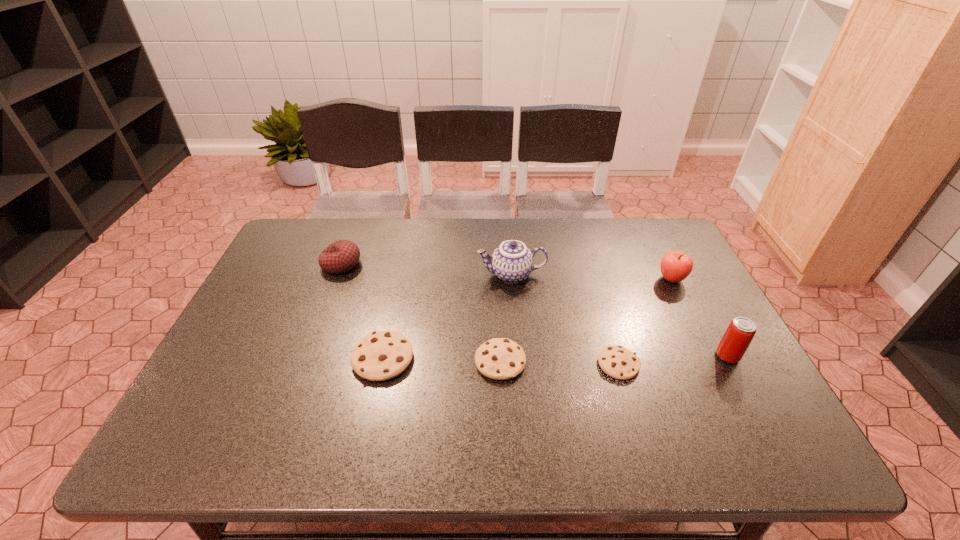
In the image, there is a desktop. Where is `vacant space at the far left corner`? This screenshot has height=540, width=960. vacant space at the far left corner is located at coordinates (331, 220).

This screenshot has height=540, width=960. I want to click on vacant region at the far right corner of the desktop, so click(660, 253).

Where is `free space between the third object from right to left and the apple`? free space between the third object from right to left and the apple is located at coordinates (645, 322).

The image size is (960, 540). I want to click on vacant area that lies between the rightmost cookie and the sixth tallest object, so click(x=560, y=363).

Where is `empty space that is in between the fifth tallest object and the second cookie from right to left`? The width and height of the screenshot is (960, 540). empty space that is in between the fifth tallest object and the second cookie from right to left is located at coordinates 442,360.

The image size is (960, 540). What are the coordinates of `blank region between the beer can and the fourth shortest object` in the screenshot? It's located at (534, 310).

The height and width of the screenshot is (540, 960). I want to click on unoccupied position between the shortest cookie and the second cookie from left to right, so [x=560, y=363].

Where is `vacant area that lies between the fifth tallest object and the chinaware`? The height and width of the screenshot is (540, 960). vacant area that lies between the fifth tallest object and the chinaware is located at coordinates (447, 316).

The width and height of the screenshot is (960, 540). What are the coordinates of `free space that is in between the chinaware and the leftmost cookie` in the screenshot? It's located at (447, 316).

At what (x,y) coordinates should I click in order to perform the action: click on free space between the third shortest object and the chinaware. Please return your answer as a coordinate pair (x, y). Looking at the image, I should click on (447, 316).